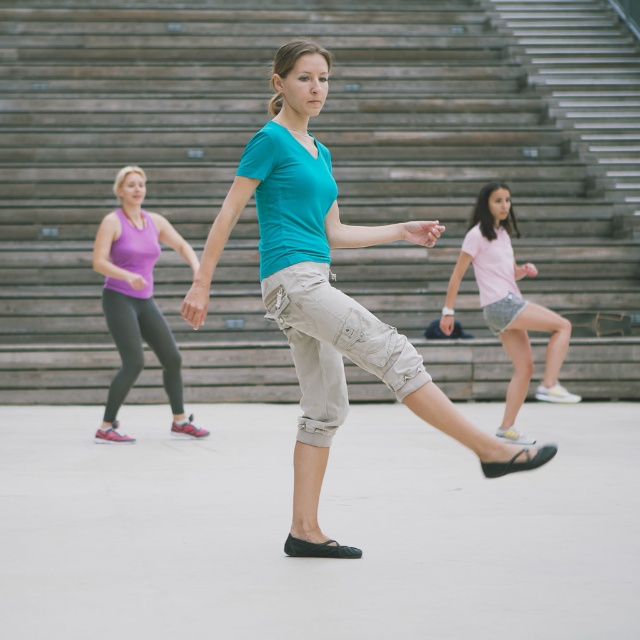
Question: Which is nearer to the purple fabric tank top at left?

Choices:
 (A) teal matte shirt at center
 (B) light pink cotton shorts at center
 (C) wooden stairs at center

Answer: (B)

Question: Does wooden stairs at center have a larger size compared to purple fabric tank top at left?

Choices:
 (A) no
 (B) yes

Answer: (B)

Question: Where is wooden stairs at center located in relation to purple fabric tank top at left in the image?

Choices:
 (A) below
 (B) above

Answer: (B)

Question: Is purple fabric tank top at left thinner than light pink cotton shorts at center?

Choices:
 (A) no
 (B) yes

Answer: (B)

Question: Among these points, which one is nearest to the camera?

Choices:
 (A) (304, 461)
 (B) (502, 292)

Answer: (A)

Question: Which object is farther from the camera taking this photo?

Choices:
 (A) purple fabric tank top at left
 (B) teal matte shirt at center
 (C) wooden stairs at center

Answer: (C)